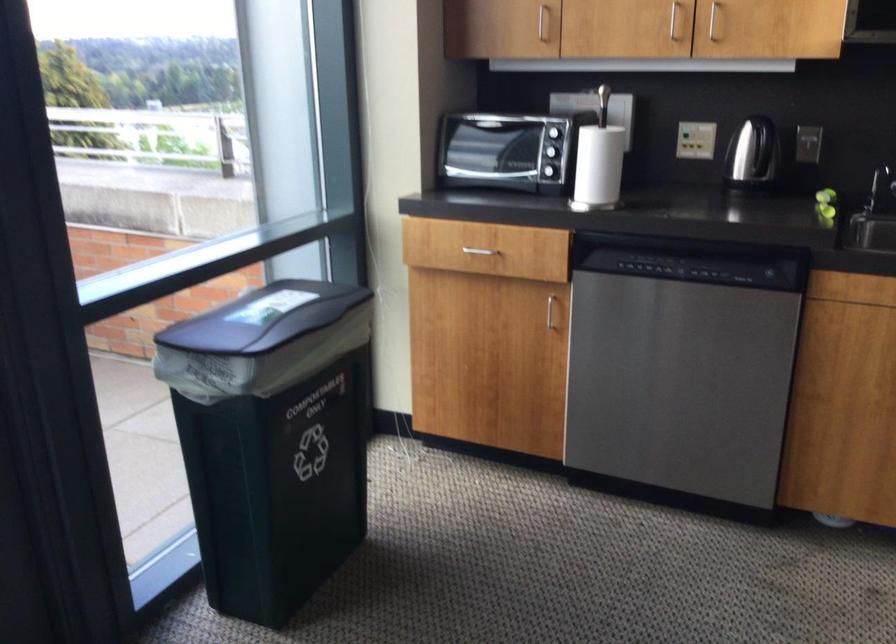
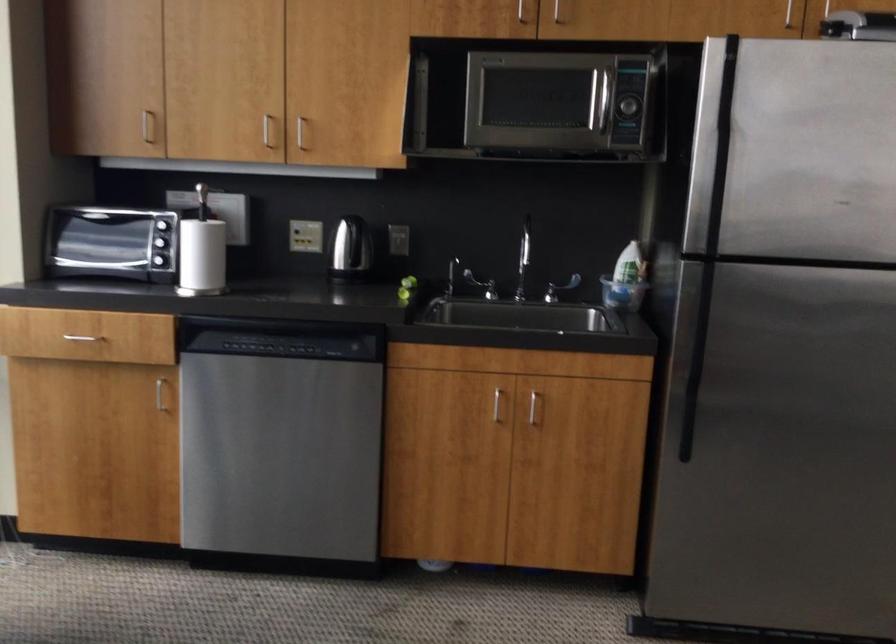
Where in the second image is the point corresponding to (x=474, y=252) from the first image?

(82, 337)